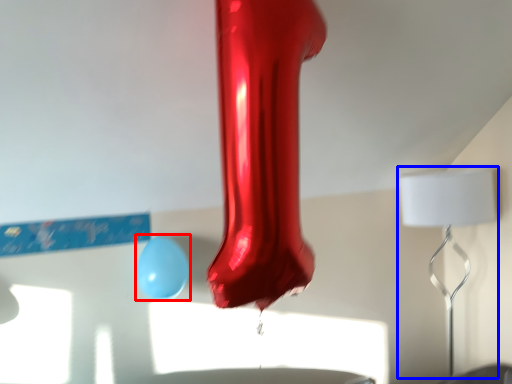
Question: Which point is closer to the camera, balloon (highlighted by a red box) or lamp (highlighted by a blue box)?

Choices:
 (A) balloon
 (B) lamp

Answer: (A)